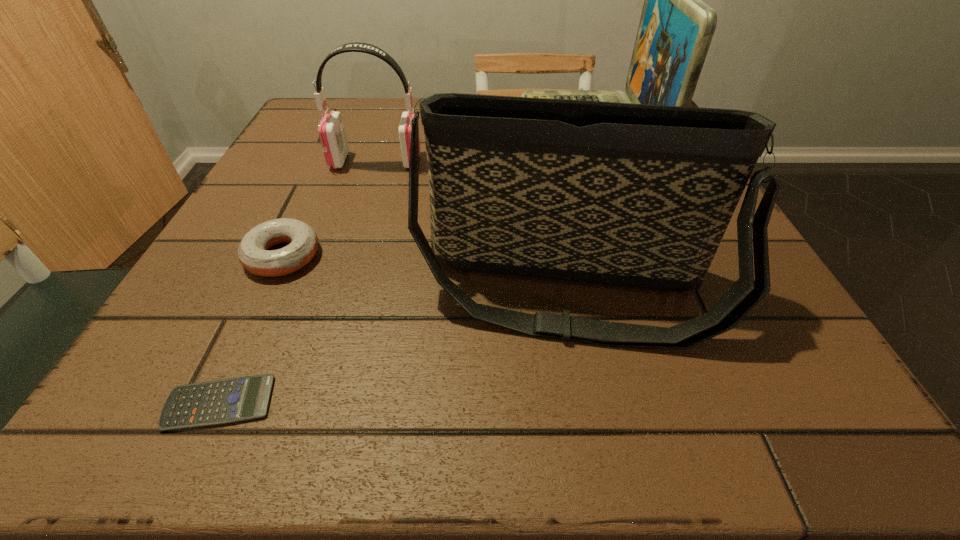
The image size is (960, 540). Find the location of `free region that satisfies the following two spatial constraints: 1. on the front side of the second shortest object; 2. on the right side of the handbag`. free region that satisfies the following two spatial constraints: 1. on the front side of the second shortest object; 2. on the right side of the handbag is located at coordinates tap(267, 291).

Locate an element on the screen. The image size is (960, 540). vacant position in the image that satisfies the following two spatial constraints: 1. on the outer surface of the earphone; 2. on the right side of the handbag is located at coordinates (335, 291).